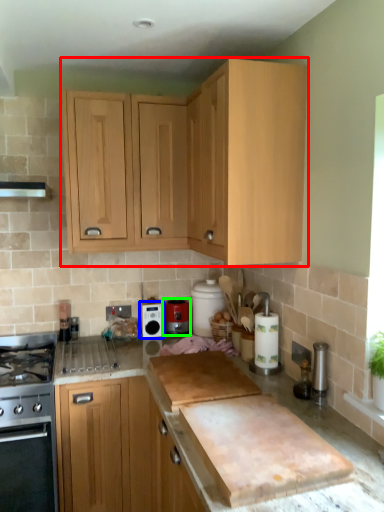
Question: Considering the real-world distances, which object is closest to cabinetry (highlighted by a red box)? kitchen appliance (highlighted by a blue box) or kitchen appliance (highlighted by a green box).

Choices:
 (A) kitchen appliance
 (B) kitchen appliance

Answer: (A)